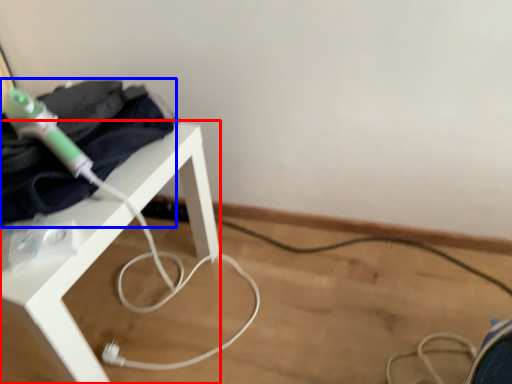
Question: Which object appears closest to the camera in this image, table (highlighted by a red box) or clothing (highlighted by a blue box)?

Choices:
 (A) table
 (B) clothing

Answer: (A)